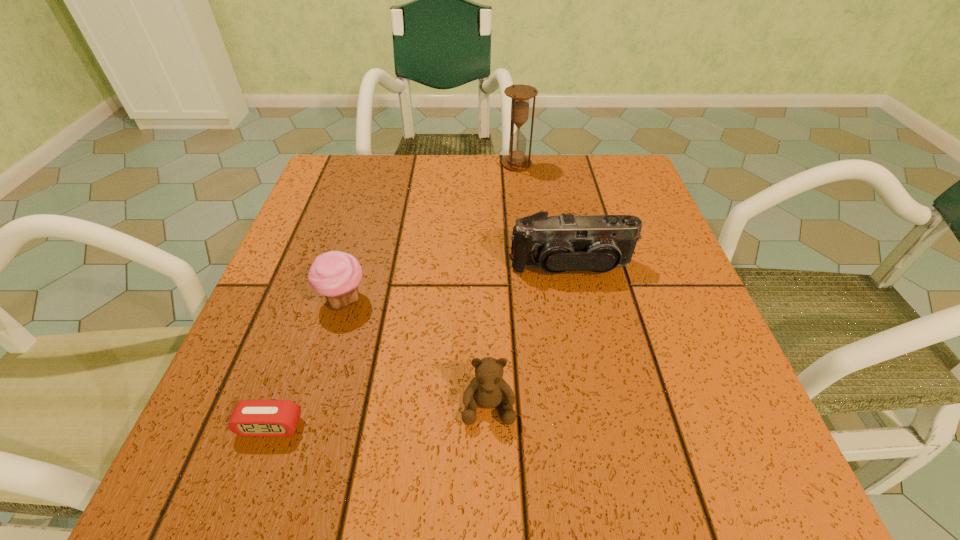
The width and height of the screenshot is (960, 540). Find the location of `the farthest object`. the farthest object is located at coordinates (520, 95).

This screenshot has height=540, width=960. What are the coordinates of `hourglass` in the screenshot? It's located at (520, 95).

This screenshot has height=540, width=960. What are the coordinates of `the second farthest object` in the screenshot? It's located at (597, 243).

Find the location of a particular element. This screenshot has width=960, height=540. cupcake is located at coordinates (336, 275).

What are the coordinates of `teddy bear` in the screenshot? It's located at point(488,390).

This screenshot has width=960, height=540. I want to click on the shortest object, so click(x=255, y=418).

What are the coordinates of `free space located 0.090m on the right of the farthest object` in the screenshot? It's located at (567, 164).

Find the location of a particular element. vacant space located 0.260m on the front-facing side of the camcorder is located at coordinates (601, 411).

Where is `blank area located 0.200m on the right of the third farthest object`? The width and height of the screenshot is (960, 540). blank area located 0.200m on the right of the third farthest object is located at coordinates (481, 300).

The height and width of the screenshot is (540, 960). I want to click on object at the far edge, so click(520, 95).